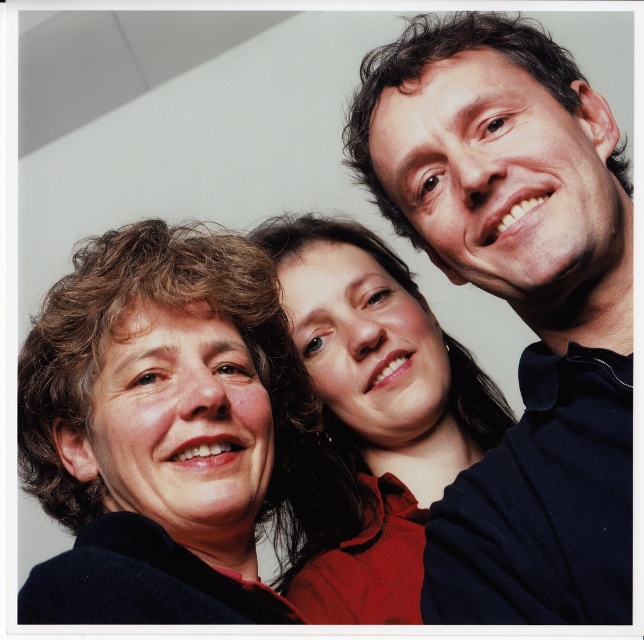
Question: Which is farther from the matte black shirt at upper right?

Choices:
 (A) matte black jacket at left
 (B) smooth red shirt at center

Answer: (B)

Question: Does matte black jacket at left have a lesser width compared to smooth red shirt at center?

Choices:
 (A) no
 (B) yes

Answer: (B)

Question: Can you confirm if matte black shirt at upper right is positioned to the left of matte black jacket at left?

Choices:
 (A) no
 (B) yes

Answer: (A)

Question: Can you confirm if matte black jacket at left is bigger than smooth red shirt at center?

Choices:
 (A) no
 (B) yes

Answer: (A)

Question: Which object is the farthest from the matte black jacket at left?

Choices:
 (A) matte black shirt at upper right
 (B) smooth red shirt at center

Answer: (A)

Question: Which of the following is the farthest from the observer?

Choices:
 (A) (386, 257)
 (B) (468, 125)

Answer: (A)